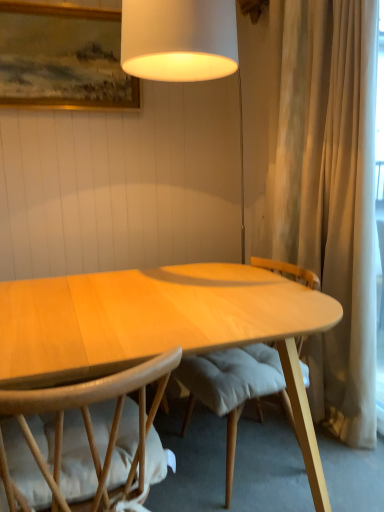
Question: Is light wood desk at center surrounding wooden framed painting at upper left?

Choices:
 (A) no
 (B) yes

Answer: (A)

Question: Can you confirm if light wood desk at center is wider than wooden framed painting at upper left?

Choices:
 (A) yes
 (B) no

Answer: (A)

Question: From the image's perspective, would you say light wood desk at center is positioned over wooden framed painting at upper left?

Choices:
 (A) no
 (B) yes

Answer: (A)

Question: Is light wood desk at center smaller than wooden framed painting at upper left?

Choices:
 (A) no
 (B) yes

Answer: (A)

Question: From the image's perspective, would you say light wood desk at center is shown under wooden framed painting at upper left?

Choices:
 (A) yes
 (B) no

Answer: (A)

Question: Is light wood desk at center closer to camera compared to wooden framed painting at upper left?

Choices:
 (A) no
 (B) yes

Answer: (B)

Question: Is wooden framed painting at upper left oriented towards light wood desk at center?

Choices:
 (A) yes
 (B) no

Answer: (B)

Question: Does wooden framed painting at upper left have a greater width compared to light wood desk at center?

Choices:
 (A) no
 (B) yes

Answer: (A)

Question: From a real-world perspective, is wooden framed painting at upper left physically above light wood desk at center?

Choices:
 (A) no
 (B) yes

Answer: (B)

Question: Considering the relative sizes of wooden framed painting at upper left and light wood desk at center in the image provided, is wooden framed painting at upper left thinner than light wood desk at center?

Choices:
 (A) no
 (B) yes

Answer: (B)

Question: Is wooden framed painting at upper left closer to camera compared to light wood desk at center?

Choices:
 (A) yes
 (B) no

Answer: (B)

Question: Is wooden framed painting at upper left with light wood desk at center?

Choices:
 (A) no
 (B) yes

Answer: (A)

Question: Does wooden framed painting at upper left have a larger size compared to light brown wood chair at lower left?

Choices:
 (A) yes
 (B) no

Answer: (B)